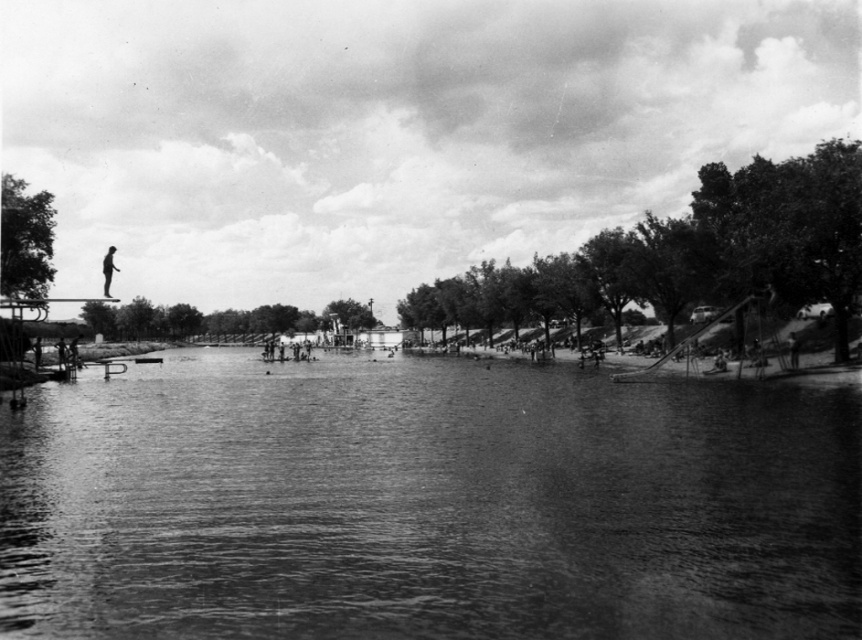
Can you confirm if smooth water at center is positioned below silhouette figure at left?

Indeed, smooth water at center is positioned under silhouette figure at left.

Which is in front, point (728, 429) or point (113, 269)?

Point (728, 429)

Does point (186, 486) come in front of point (109, 280)?

That is True.

At what (x,y) coordinates should I click in order to perform the action: click on smooth water at center. Please return your answer as a coordinate pair (x, y). The image size is (862, 640). Looking at the image, I should click on (425, 506).